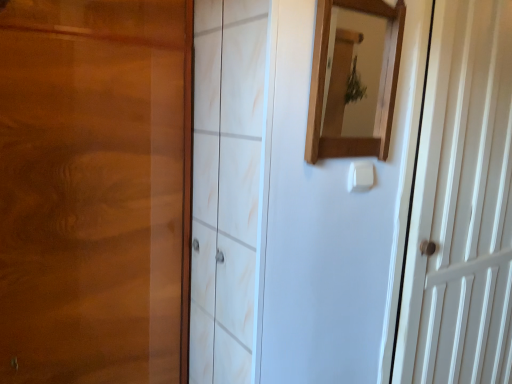
Question: Relative to wooden mirror at upper center, is white wooden door at right in front or behind?

Choices:
 (A) front
 (B) behind

Answer: (B)

Question: Is point (437, 167) closer or farther from the camera than point (392, 39)?

Choices:
 (A) farther
 (B) closer

Answer: (A)

Question: Estimate the real-world distances between objects in this image. Which object is closer to the white wooden door at right?

Choices:
 (A) wooden mirror at upper center
 (B) white plastic light switch at center

Answer: (A)

Question: Which of these objects is positioned closest to the white plastic light switch at center?

Choices:
 (A) white wooden door at right
 (B) wooden mirror at upper center

Answer: (B)